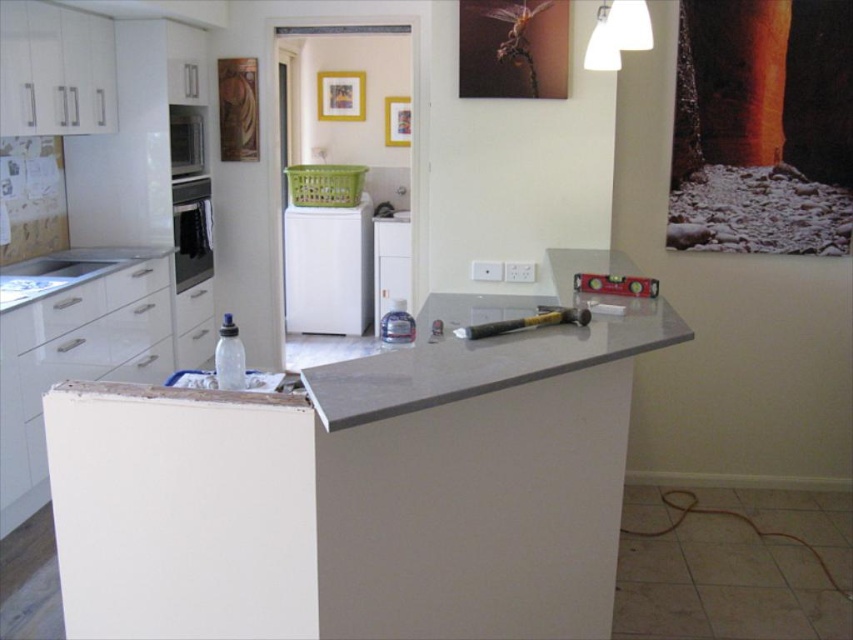
Does white glossy lampshade at upper center have a lesser height compared to white plastic dishwasher at center?

Yes, white glossy lampshade at upper center is shorter than white plastic dishwasher at center.

Is the position of white glossy lampshade at upper center more distant than that of white plastic dishwasher at center?

That is False.

Who is more distant from viewer, (x=596, y=24) or (x=401, y=212)?

The point (x=401, y=212) is more distant.

At what (x,y) coordinates should I click in order to perform the action: click on white glossy lampshade at upper center. Please return your answer as a coordinate pair (x, y). Looking at the image, I should click on (618, 33).

Is gray laminate counter at center bigger than satin black oven at left?

Indeed, gray laminate counter at center has a larger size compared to satin black oven at left.

Identify the location of gray laminate counter at center. The height and width of the screenshot is (640, 853). (357, 493).

Can you confirm if satin black microwave at left is shorter than matte gold picture frame at upper center?

In fact, satin black microwave at left may be taller than matte gold picture frame at upper center.

Looking at this image, is satin black microwave at left wider than matte gold picture frame at upper center?

In fact, satin black microwave at left might be narrower than matte gold picture frame at upper center.

Locate an element on the screen. Image resolution: width=853 pixels, height=640 pixels. satin black microwave at left is located at coordinates pos(186,140).